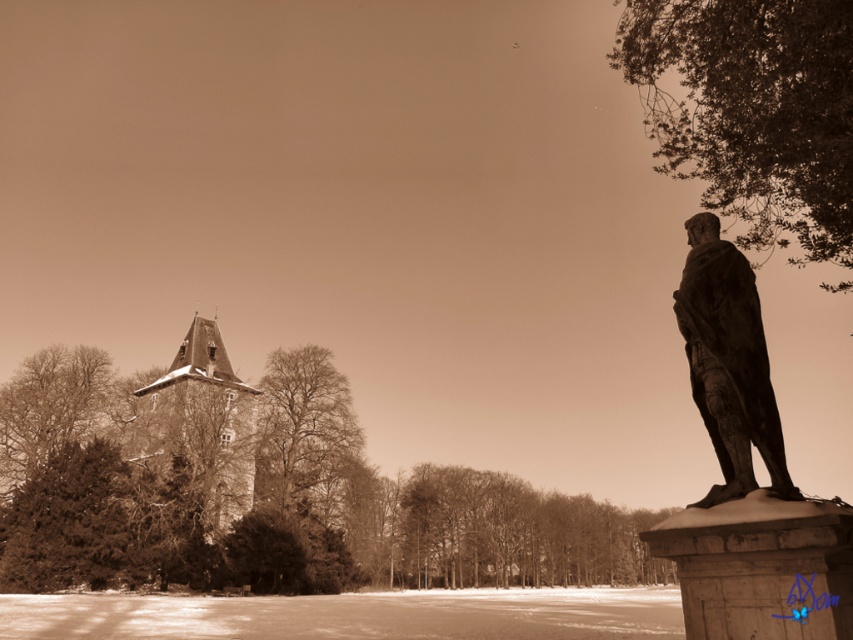
Question: Is bronze statue at right to the left of smooth stone spire at center-left from the viewer's perspective?

Choices:
 (A) no
 (B) yes

Answer: (A)

Question: Which point appears farthest from the camera in this image?

Choices:
 (A) (709, 353)
 (B) (190, 416)

Answer: (B)

Question: Is bronze statue at right positioned in front of smooth stone spire at center-left?

Choices:
 (A) no
 (B) yes

Answer: (B)

Question: Is bronze statue at right further to the viewer compared to smooth stone spire at center-left?

Choices:
 (A) yes
 (B) no

Answer: (B)

Question: Which point is closer to the camera?

Choices:
 (A) bronze statue at right
 (B) smooth stone spire at center-left

Answer: (A)